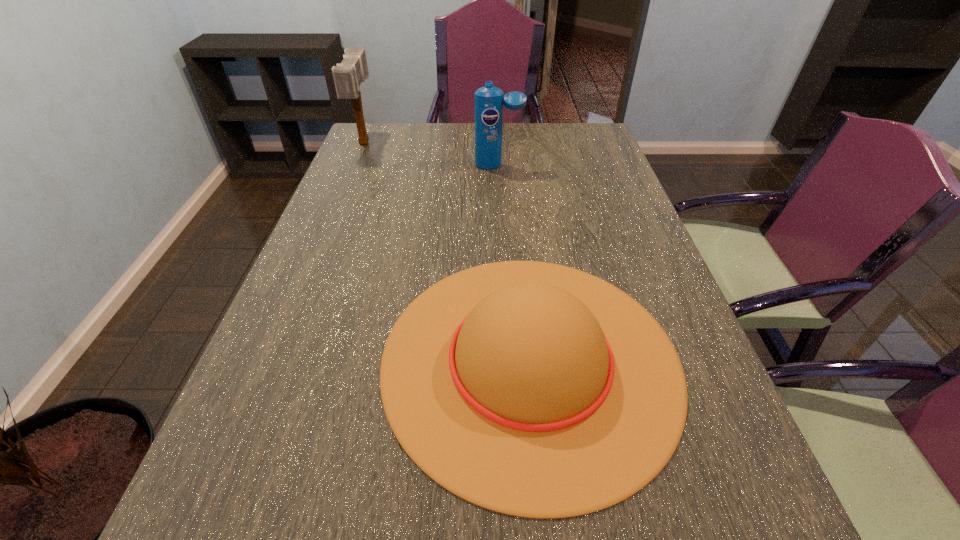
At what (x,y) coordinates should I click in order to perform the action: click on vacant area between the second farthest object and the mallet. Please return your answer as a coordinate pair (x, y). Looking at the image, I should click on (431, 154).

At what (x,y) coordinates should I click in order to perform the action: click on empty location between the nearest object and the mallet. Please return your answer as a coordinate pair (x, y). The height and width of the screenshot is (540, 960). Looking at the image, I should click on (447, 251).

Locate an element on the screen. The height and width of the screenshot is (540, 960). object that is the closest to the leftmost object is located at coordinates (489, 102).

Identify the location of the closest object to the second nearest object. (348, 75).

Identify the location of blank space that satisfies the following two spatial constraints: 1. on the front side of the shampoo; 2. on the right side of the mallet. The image size is (960, 540). (355, 165).

This screenshot has height=540, width=960. I want to click on free space that satisfies the following two spatial constraints: 1. on the front side of the leftmost object; 2. on the right side of the second farthest object, so 355,165.

This screenshot has width=960, height=540. What are the coordinates of `vacant space that satisfies the following two spatial constraints: 1. on the front side of the second nearest object; 2. on the left side of the leftmost object` in the screenshot? It's located at (355, 165).

The image size is (960, 540). What are the coordinates of `free point that satisfies the following two spatial constraints: 1. on the front side of the mallet; 2. on the right side of the shortest object` in the screenshot? It's located at (275, 359).